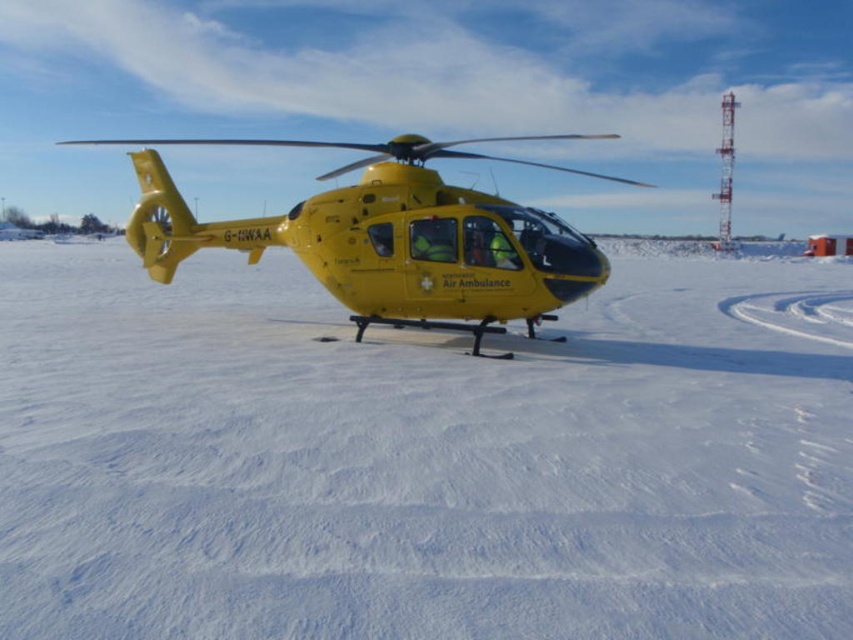
Question: Does white matte snow at center have a smaller size compared to yellow matte helicopter at center?

Choices:
 (A) yes
 (B) no

Answer: (A)

Question: Does white matte snow at center have a greater width compared to yellow matte helicopter at center?

Choices:
 (A) yes
 (B) no

Answer: (B)

Question: Does white matte snow at center have a lesser width compared to yellow matte helicopter at center?

Choices:
 (A) no
 (B) yes

Answer: (B)

Question: Among these objects, which one is nearest to the camera?

Choices:
 (A) yellow matte helicopter at center
 (B) white matte snow at center

Answer: (B)

Question: Among these objects, which one is nearest to the camera?

Choices:
 (A) yellow matte helicopter at center
 (B) white matte snow at center

Answer: (B)